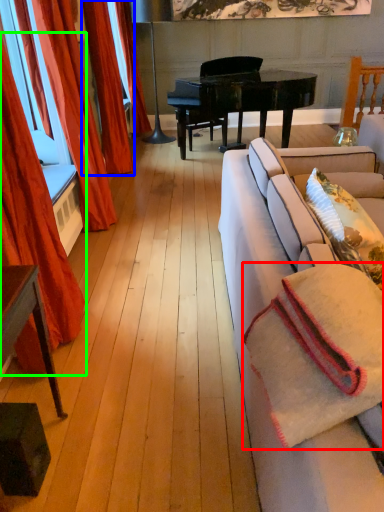
Question: Which object is positioned farthest from blanket (highlighted by a red box)? Select from curtain (highlighted by a blue box) and curtain (highlighted by a green box).

Choices:
 (A) curtain
 (B) curtain

Answer: (A)